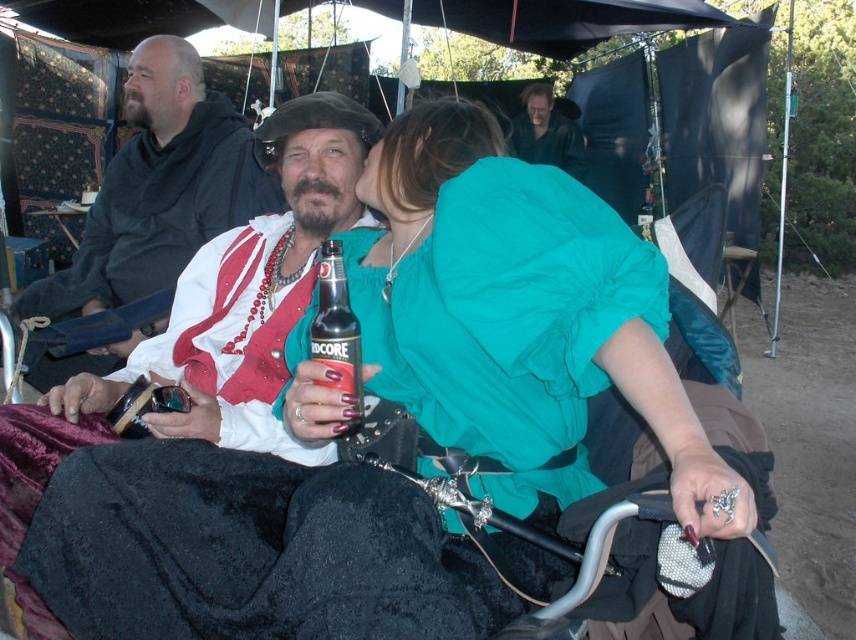
You are organizing a costume party and need to determine which shirt to choose based on size. Given the white fabric shirt at center and the smooth black shirt at upper center, which one has a bigger size?

The white fabric shirt at center is larger in size than the smooth black shirt at upper center, so you should choose the white fabric shirt at center for a bigger size.

Looking at this image, you are a photographer at the festival and want to capture both the white fabric shirt at center and the black glass bottle at center in your shot. Which object should you adjust your focus on first to ensure both are in frame?

The black glass bottle at center is behind the white fabric shirt at center, so you should focus on the black glass bottle at center first to ensure both are in frame.

You are a photographer at the festival. You need to position a spotlight at the exact center of the scene. However, you must ensure that the spotlight does not shine directly on the white fabric shirt at center. Given the coordinates provided, where should you place the spotlight to avoid the shirt?

The white fabric shirt at center is located at coordinates point (158, 188). To avoid shining the spotlight on it, position the spotlight away from these coordinates, perhaps at the opposite side or a different quadrant of the scene.